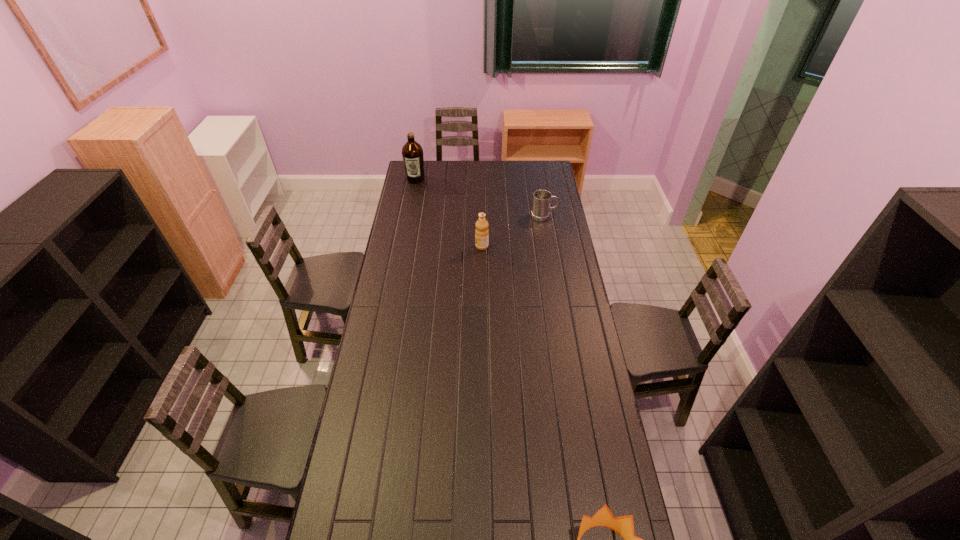
Where is `the taller olive oil`? the taller olive oil is located at coordinates (412, 153).

The width and height of the screenshot is (960, 540). Identify the location of the farthest object. (412, 153).

Where is `the right olive oil`? The height and width of the screenshot is (540, 960). the right olive oil is located at coordinates (481, 232).

I want to click on the nearer olive oil, so click(481, 232).

Find the location of a particular element. This screenshot has width=960, height=540. mug is located at coordinates (541, 208).

Locate an element on the screen. Image resolution: width=960 pixels, height=540 pixels. free location located on the label of the farther olive oil is located at coordinates (408, 219).

The image size is (960, 540). Find the location of `free space located on the label of the right olive oil`. free space located on the label of the right olive oil is located at coordinates (425, 246).

Image resolution: width=960 pixels, height=540 pixels. In order to click on vacant space positioned on the label of the right olive oil in this screenshot , I will do `click(452, 246)`.

At what (x,y) coordinates should I click in order to perform the action: click on free space located on the label of the right olive oil. Please return your answer as a coordinate pair (x, y). This screenshot has height=540, width=960. Looking at the image, I should click on (413, 246).

You are a GUI agent. You are given a task and a screenshot of the screen. Output one action in this format:
    pyautogui.click(x=<x>, y=<y>)
    Task: Click on the object located in the far edge section of the desktop
    This screenshot has width=960, height=540.
    Given the screenshot: What is the action you would take?
    (x=412, y=153)